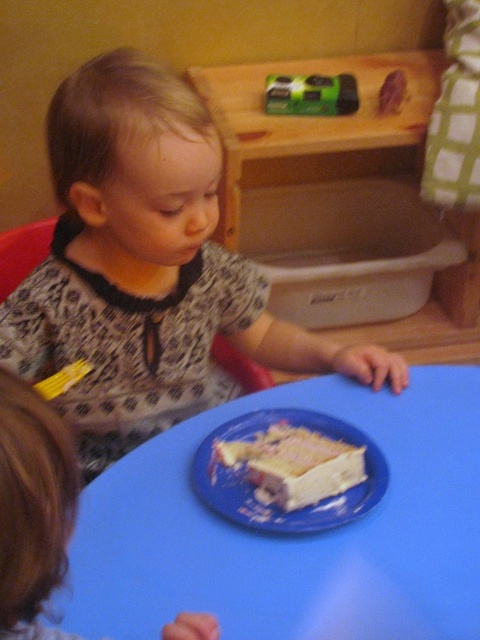
Question: Does blue plastic table at center lie behind white frosted cake at center?

Choices:
 (A) yes
 (B) no

Answer: (B)

Question: From the image, what is the correct spatial relationship of blue plastic table at center in relation to smooth brown hair at lower left?

Choices:
 (A) right
 (B) left

Answer: (A)

Question: Which point is farther to the camera?

Choices:
 (A) matte black shirt at upper left
 (B) white frosted cake at center
 (C) blue plastic table at center

Answer: (B)

Question: Which point is farther to the camera?

Choices:
 (A) (59, 106)
 (B) (271, 464)

Answer: (A)

Question: Does smooth brown hair at lower left appear on the right side of white frosted cake at center?

Choices:
 (A) yes
 (B) no

Answer: (B)

Question: Estimate the real-world distances between objects in this image. Which object is farther from the smooth brown hair at lower left?

Choices:
 (A) blue plastic table at center
 (B) white frosted cake at center

Answer: (B)